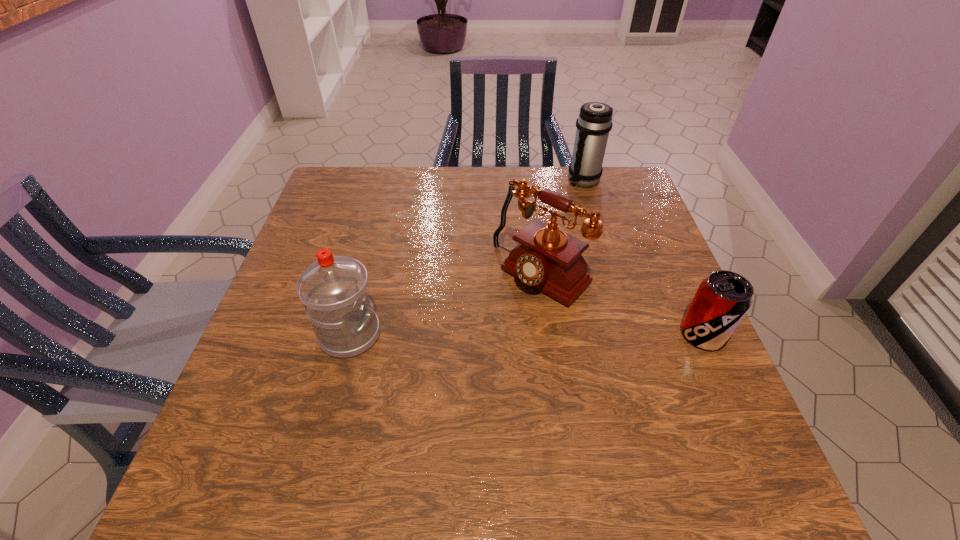
Where is `vacant point located between the leftmost object and the third nearest object`? The image size is (960, 540). vacant point located between the leftmost object and the third nearest object is located at coordinates (445, 305).

Locate an element on the screen. Image resolution: width=960 pixels, height=540 pixels. empty space that is in between the rightmost object and the second object from left to right is located at coordinates [x=622, y=305].

You are a GUI agent. You are given a task and a screenshot of the screen. Output one action in this format:
    pyautogui.click(x=<x>, y=<y>)
    Task: Click on the vacant area that lies between the second object from left to right and the rightmost object
    This screenshot has width=960, height=540.
    Given the screenshot: What is the action you would take?
    pyautogui.click(x=622, y=305)

Find the location of a particular element. free point between the third nearest object and the shortest object is located at coordinates (622, 305).

The height and width of the screenshot is (540, 960). What are the coordinates of `free spot between the farthest object and the soda can` in the screenshot? It's located at (643, 258).

The width and height of the screenshot is (960, 540). Find the location of `vacant space that is in between the shortest object and the third object from right to left`. vacant space that is in between the shortest object and the third object from right to left is located at coordinates (622, 305).

Find the location of a particular element. empty space between the second farthest object and the second object from right to left is located at coordinates (563, 228).

Point out which object is positioned as the nearest to the shortest object. Please provide its 2D coordinates. Your answer should be formatted as a tuple, i.e. [(x, y)], where the tuple contains the x and y coordinates of a point satisfying the conditions above.

[(550, 260)]

Where is `object that is the second closest one to the telephone`? The height and width of the screenshot is (540, 960). object that is the second closest one to the telephone is located at coordinates click(x=334, y=289).

Image resolution: width=960 pixels, height=540 pixels. I want to click on vacant area that satisfies the following two spatial constraints: 1. on the back side of the telephone; 2. on the right side of the thermos bottle, so click(528, 180).